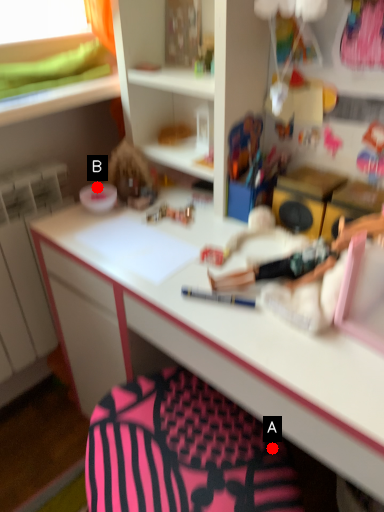
Question: Two points are circled on the image, labeled by A and B beside each circle. Among these points, which one is farthest from the camera?

Choices:
 (A) A is further
 (B) B is further

Answer: (B)